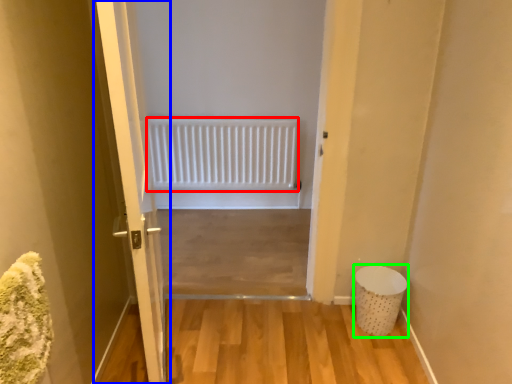
Question: Which is farther away from radiator (highlighted by a red box)? door (highlighted by a blue box) or laundry basket (highlighted by a green box)?

Choices:
 (A) door
 (B) laundry basket

Answer: (A)